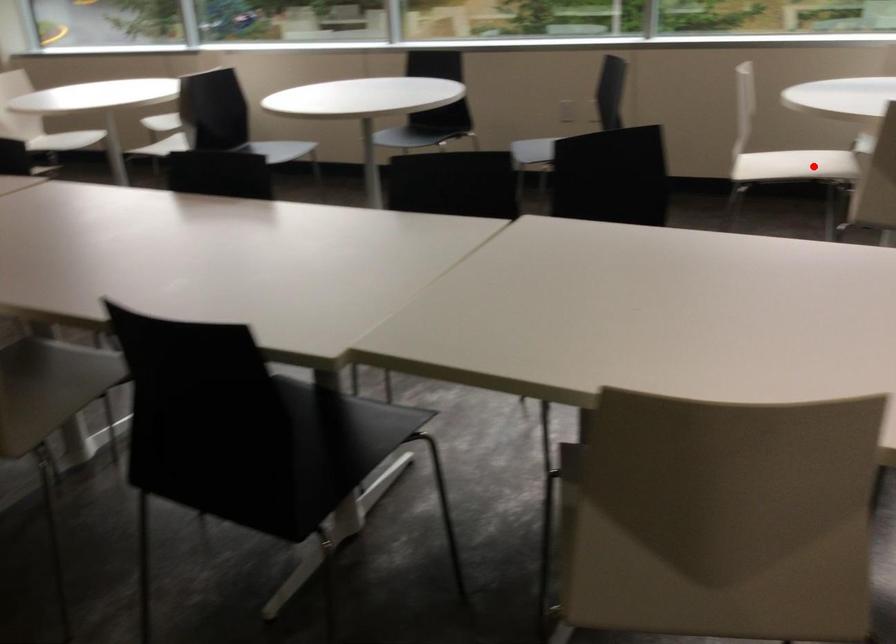
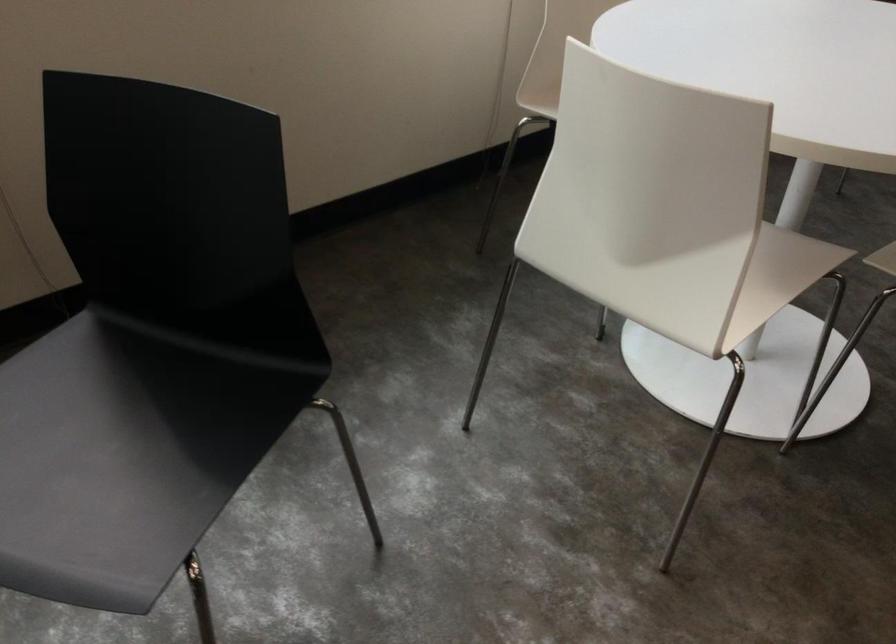
Locate, in the second image, the point that corresponds to the highlighted location in the first image.

(777, 277)